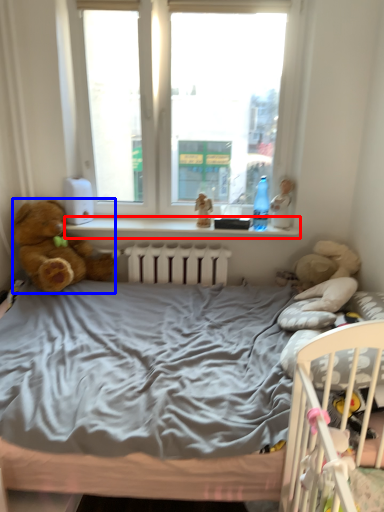
Question: Among these objects, which one is nearest to the camera, window sill (highlighted by a red box) or teddy bear (highlighted by a blue box)?

Choices:
 (A) window sill
 (B) teddy bear

Answer: (B)